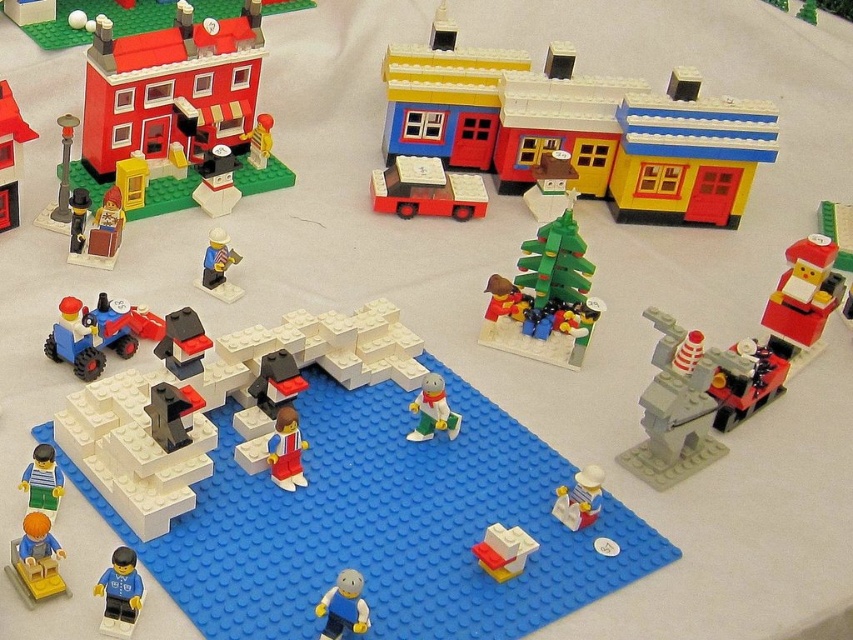
From the picture: Who is more forward, (x=808, y=332) or (x=270, y=461)?

Point (x=270, y=461) is in front.

Who is shorter, red matte santa at right or brick red minifigure at center?

brick red minifigure at center is shorter.

Who is more forward, (775,324) or (292,412)?

Positioned in front is point (292,412).

Find the location of a particular element. The height and width of the screenshot is (640, 853). red matte santa at right is located at coordinates (804, 291).

Between yellow matte building at center and red matte santa at right, which one appears on the left side from the viewer's perspective?

Positioned to the left is yellow matte building at center.

Is point (399, 84) closer to camera compared to point (816, 316)?

No.

Does point (447, 90) lie in front of point (787, 278)?

No, (447, 90) is further to viewer.

I want to click on yellow matte building at center, so click(x=577, y=129).

Which is in front, point (55, 500) or point (223, 260)?

Positioned in front is point (55, 500).

Can you confirm if matte green figure at lower left is shorter than matte yellow figure at center-left?

Indeed, matte green figure at lower left has a lesser height compared to matte yellow figure at center-left.

Who is more distant from viewer, (38,451) or (223,243)?

The point (223,243) is behind.

The width and height of the screenshot is (853, 640). Identify the location of matte green figure at lower left. (42, 481).